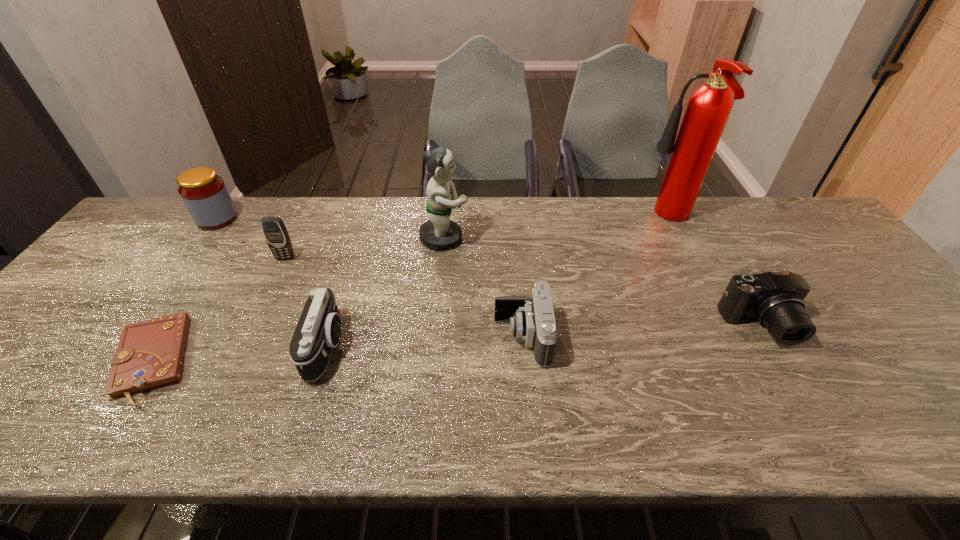
The image size is (960, 540). In order to click on vacant space located 0.400m at the front of the third object from right to left with an open lens cover in this screenshot , I will do pos(326,338).

Identify the location of vacant position located on the left of the shortest object. The height and width of the screenshot is (540, 960). (38, 360).

Locate an element on the screen. Image resolution: width=960 pixels, height=540 pixels. fire extinguisher located at the far edge is located at coordinates [708, 108].

This screenshot has width=960, height=540. What are the coordinates of `figurine at the far edge` in the screenshot? It's located at (439, 233).

In order to click on jar positioned at the far edge in this screenshot , I will do `click(205, 195)`.

This screenshot has width=960, height=540. I want to click on object that is at the near edge, so click(x=149, y=355).

This screenshot has height=540, width=960. Identify the location of free space at the far edge. (418, 217).

This screenshot has width=960, height=540. What are the coordinates of `free location at the near edge of the desktop` in the screenshot? It's located at (891, 442).

This screenshot has width=960, height=540. In order to click on blank area at the left edge in this screenshot , I will do `click(138, 251)`.

At what (x,y) coordinates should I click in order to perform the action: click on vacant space at the right edge of the desktop. Please return your answer as a coordinate pair (x, y). Looking at the image, I should click on (844, 288).